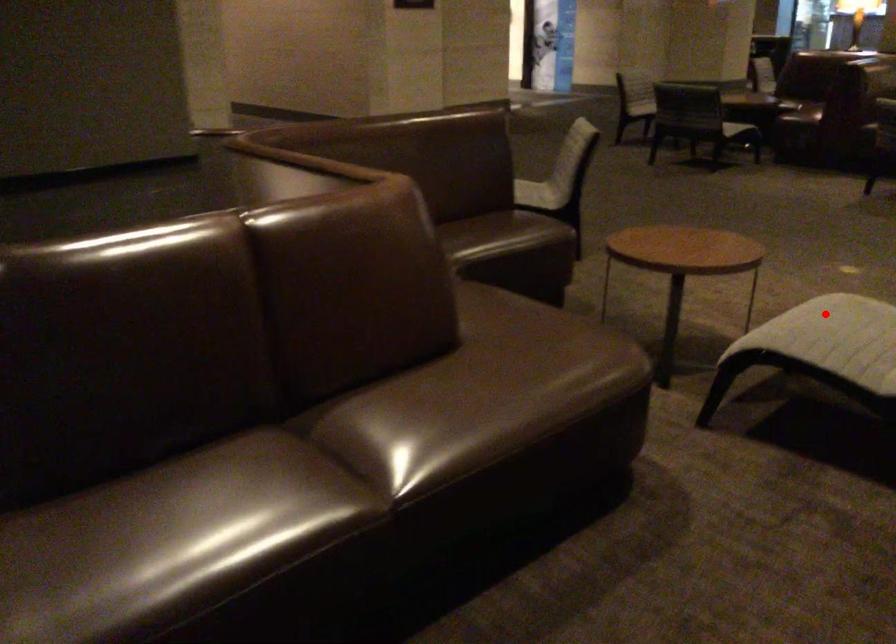
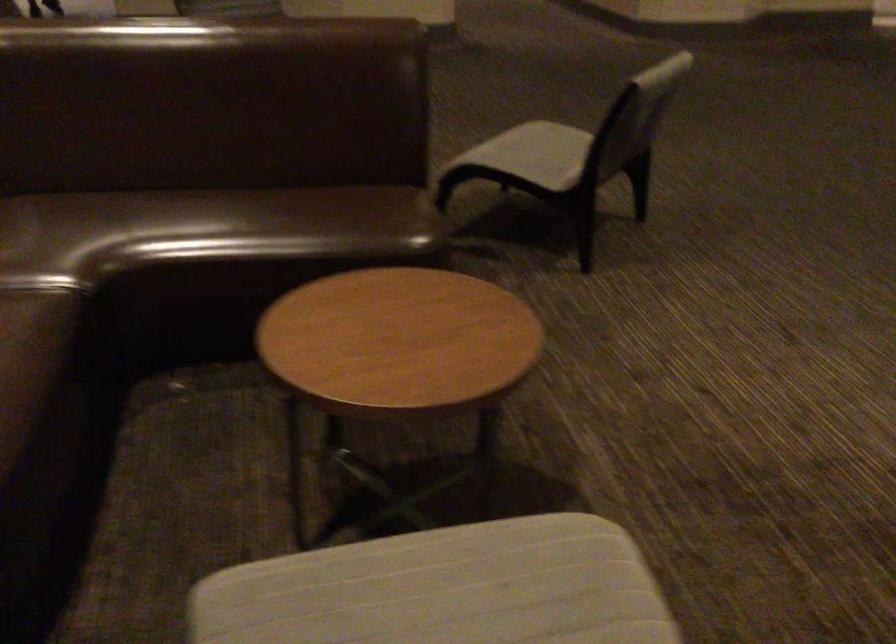
Question: I am providing you with two images of the same scene from different viewpoints. A red point is shown in image1. For the corresponding object point in image2, is it positioned nearer or farther from the camera?

Choices:
 (A) Nearer
 (B) Farther

Answer: (A)